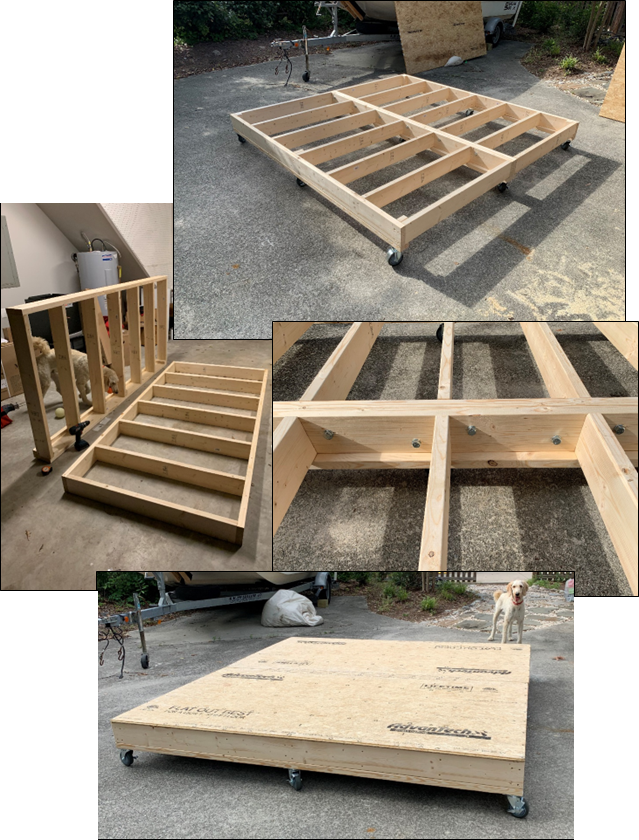
At what (x,y) coordinates should I click in order to perform the action: click on water heater. Please return your answer as a coordinate pair (x, y). Looking at the image, I should click on (96, 271).